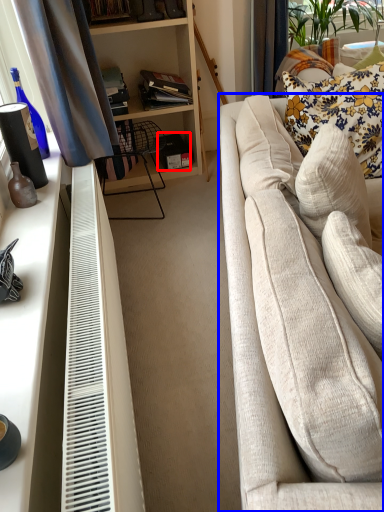
Question: Which point is further to the camera, box (highlighted by a red box) or studio couch (highlighted by a blue box)?

Choices:
 (A) box
 (B) studio couch

Answer: (A)